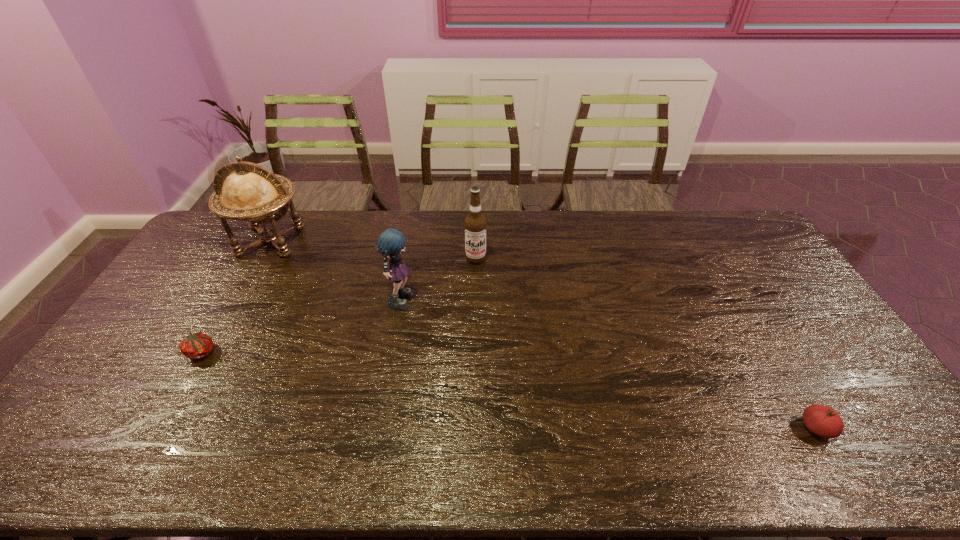
Where is `blank space at the near edge of the desktop`? blank space at the near edge of the desktop is located at coordinates (338, 437).

This screenshot has height=540, width=960. In order to click on blank space at the right edge of the desktop in this screenshot , I will do `click(756, 266)`.

In the image, there is a desktop. Identify the location of free space at the far right corner. This screenshot has height=540, width=960. (735, 238).

At what (x,y) coordinates should I click in order to perform the action: click on free space that is in between the farther tomato and the third nearest object. Please return your answer as a coordinate pair (x, y). Looking at the image, I should click on tap(301, 325).

Where is `vacant area that lies between the rag doll and the globe`? The image size is (960, 540). vacant area that lies between the rag doll and the globe is located at coordinates (336, 268).

Where is `unoccupied position between the shortest object and the fourth tallest object`? Image resolution: width=960 pixels, height=540 pixels. unoccupied position between the shortest object and the fourth tallest object is located at coordinates (509, 390).

The image size is (960, 540). I want to click on vacant region between the left tomato and the rightmost object, so coord(509,390).

Where is `free area in between the second nearest object and the second object from right to left`? The height and width of the screenshot is (540, 960). free area in between the second nearest object and the second object from right to left is located at coordinates (339, 306).

Where is `vacant area that lies between the shorter tomato and the globe`? This screenshot has width=960, height=540. vacant area that lies between the shorter tomato and the globe is located at coordinates (236, 296).

You are a GUI agent. You are given a task and a screenshot of the screen. Output one action in this format:
    pyautogui.click(x=<x>, y=<y>)
    Task: Click on the free point between the third object from left to right and the tallest object
    The image size is (960, 540).
    Given the screenshot: What is the action you would take?
    336,268